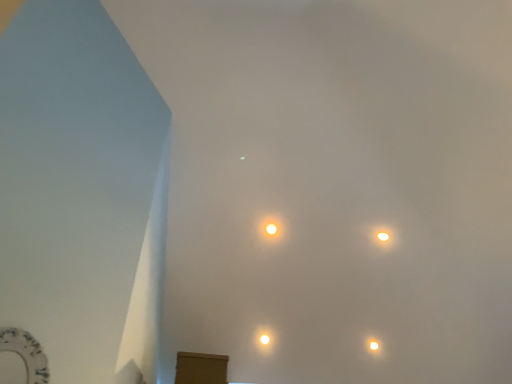
Question: Which direction should I rotate to look at matte yellow light at center, which ranks as the 2th lamp in left-to-right order, — up or down?

Choices:
 (A) up
 (B) down

Answer: (B)

Question: Is white glossy lamp at upper right, the second lamp positioned from the bottom, bigger than matte yellow light at center, marked as the 2th lamp in a right-to-left arrangement?

Choices:
 (A) no
 (B) yes

Answer: (A)

Question: From a real-world perspective, is white glossy lamp at upper right, which is counted as the 3th lamp, starting from the left, on top of matte yellow light at center, which is the 3th lamp from bottom to top?

Choices:
 (A) no
 (B) yes

Answer: (B)

Question: Can you confirm if white glossy lamp at upper right, which appears as the second lamp when viewed from the top, is smaller than matte yellow light at center, which is the 3th lamp from bottom to top?

Choices:
 (A) yes
 (B) no

Answer: (A)

Question: Can we say white glossy lamp at upper right, which appears as the second lamp when viewed from the top, lies outside matte yellow light at center, which is the first lamp in top-to-bottom order?

Choices:
 (A) yes
 (B) no

Answer: (A)

Question: From a real-world perspective, is white glossy lamp at upper right, the second lamp positioned from the bottom, physically below matte yellow light at center, which ranks as the 2th lamp in left-to-right order?

Choices:
 (A) no
 (B) yes

Answer: (A)

Question: Is white glossy lamp at upper right, the second lamp positioned from the bottom, further to the viewer compared to matte yellow light at center, which is the first lamp in top-to-bottom order?

Choices:
 (A) no
 (B) yes

Answer: (B)

Question: From a real-world perspective, is matte yellow light at center, which is the first lamp in top-to-bottom order, located higher than white glossy lamp at upper right, which is counted as the 3th lamp, starting from the left?

Choices:
 (A) no
 (B) yes

Answer: (A)

Question: Does matte yellow light at center, which ranks as the 2th lamp in left-to-right order, have a smaller size compared to white glossy lamp at upper right, which is counted as the 3th lamp, starting from the left?

Choices:
 (A) no
 (B) yes

Answer: (A)

Question: Is matte yellow light at center, marked as the 2th lamp in a right-to-left arrangement, positioned with its back to white glossy lamp at upper right, the second lamp positioned from the bottom?

Choices:
 (A) no
 (B) yes

Answer: (A)

Question: Considering the relative positions of matte yellow light at center, marked as the 2th lamp in a right-to-left arrangement, and white glossy lamp at upper right, the first lamp viewed from the right, in the image provided, is matte yellow light at center, marked as the 2th lamp in a right-to-left arrangement, behind white glossy lamp at upper right, the first lamp viewed from the right,?

Choices:
 (A) yes
 (B) no

Answer: (B)

Question: Is there a large distance between matte yellow light at center, which is the 3th lamp from bottom to top, and white glossy lamp at upper right, which appears as the second lamp when viewed from the top?

Choices:
 (A) no
 (B) yes

Answer: (A)

Question: Considering the relative sizes of matte yellow light at center, which is the 3th lamp from bottom to top, and white glossy lamp at upper right, the first lamp viewed from the right, in the image provided, is matte yellow light at center, which is the 3th lamp from bottom to top, wider than white glossy lamp at upper right, the first lamp viewed from the right,?

Choices:
 (A) no
 (B) yes

Answer: (B)

Question: Does white glossy lamp at upper right, the first lamp viewed from the right, have a larger size compared to white glossy lamp at center, the first lamp ordered from the bottom?

Choices:
 (A) no
 (B) yes

Answer: (B)